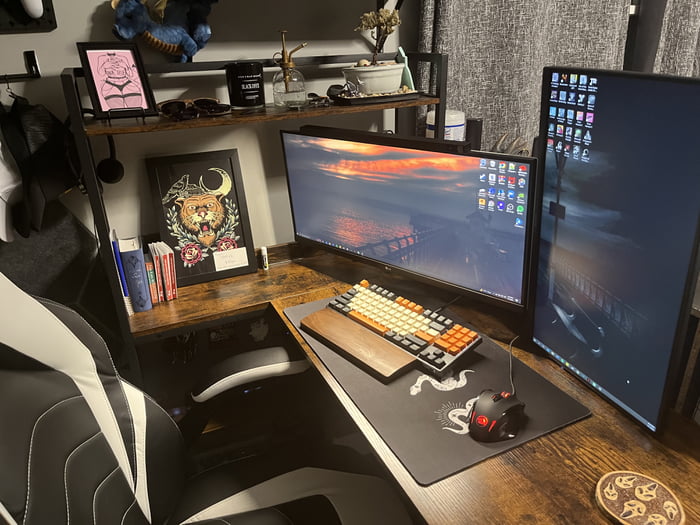
This screenshot has width=700, height=525. I want to click on bonsai plant, so click(x=374, y=61).